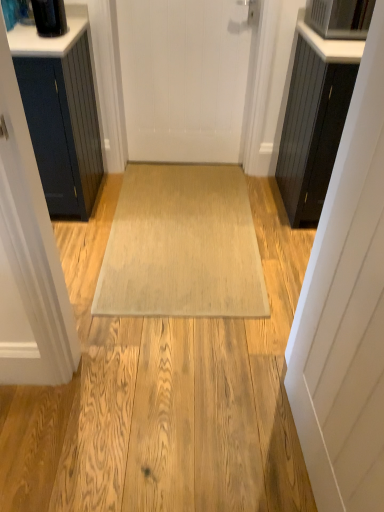
Describe the element at coordinates (346, 311) in the screenshot. I see `white matte door at right, the first door from the front` at that location.

What do you see at coordinates (182, 246) in the screenshot? This screenshot has height=512, width=384. I see `beige woven mat at center` at bounding box center [182, 246].

I want to click on satin silver microwave at upper right, so click(x=340, y=18).

Describe the element at coordinates (340, 18) in the screenshot. I see `satin silver microwave at upper right` at that location.

Where is `black wood cabinet at right`? Image resolution: width=384 pixels, height=512 pixels. black wood cabinet at right is located at coordinates (314, 120).

In the image, is white matte door at right, marked as the 1th door in a right-to-left arrangement, on the left side or the right side of satin silver microwave at upper right?

Clearly, white matte door at right, marked as the 1th door in a right-to-left arrangement, is on the left of satin silver microwave at upper right in the image.

How different are the orientations of white matte door at right, the first door from the front, and satin silver microwave at upper right in degrees?

The facing directions of white matte door at right, the first door from the front, and satin silver microwave at upper right are 87.1 degrees apart.

How far apart are white matte door at right, the first door from the front, and satin silver microwave at upper right?

white matte door at right, the first door from the front, is 4.78 feet away from satin silver microwave at upper right.

Considering the relative sizes of white matte door at right, which ranks as the first door in bottom-to-top order, and satin silver microwave at upper right in the image provided, is white matte door at right, which ranks as the first door in bottom-to-top order, wider than satin silver microwave at upper right?

No, white matte door at right, which ranks as the first door in bottom-to-top order, is not wider than satin silver microwave at upper right.

Which is more distant, (244, 219) or (27, 46)?

The point (244, 219) is more distant.

Which of these two, beige woven mat at center or black glossy container at upper left, is bigger?

beige woven mat at center.

Looking at this image, from their relative heights in the image, would you say beige woven mat at center is taller or shorter than black glossy container at upper left?

Considering their sizes, beige woven mat at center has less height than black glossy container at upper left.

Is point (334, 2) closer or farther from the camera than point (317, 441)?

Point (334, 2) appears to be farther away from the viewer than point (317, 441).

The image size is (384, 512). In order to click on door located in front of the satin silver microwave at upper right in this screenshot , I will do `click(346, 311)`.

Is satin silver microwave at upper right further to the viewer compared to white matte door at right, which appears as the second door when viewed from the back?

Yes.

Could you tell me if satin silver microwave at upper right is facing white matte door at right, the first door from the front?

Yes, satin silver microwave at upper right is facing white matte door at right, the first door from the front.

Can you tell me how much black wood cabinet at right and white matte door at right, the first door from the front, differ in facing direction?

86.4 degrees separate the facing orientations of black wood cabinet at right and white matte door at right, the first door from the front.

Does black wood cabinet at right have a lesser width compared to white matte door at right, which appears as the second door when viewed from the back?

Incorrect, the width of black wood cabinet at right is not less than that of white matte door at right, which appears as the second door when viewed from the back.

At what (x,y) coordinates should I click in order to perform the action: click on cabinetry that is on the right side of white matte door at right, the second door in the left-to-right sequence. Please return your answer as a coordinate pair (x, y). This screenshot has width=384, height=512. Looking at the image, I should click on (314, 120).

Considering the relative positions of black wood cabinet at right and white matte door at right, which ranks as the first door in bottom-to-top order, in the image provided, is black wood cabinet at right behind white matte door at right, which ranks as the first door in bottom-to-top order,?

That is True.

Looking at this image, which object is thinner, black glossy container at upper left or satin silver microwave at upper right?

black glossy container at upper left.

Between black glossy container at upper left and satin silver microwave at upper right, which one appears on the left side from the viewer's perspective?

black glossy container at upper left.

From a real-world perspective, is black glossy container at upper left on top of satin silver microwave at upper right?

Incorrect, from a real-world perspective, black glossy container at upper left is lower than satin silver microwave at upper right.

Looking at the image, does black glossy container at upper left seem bigger or smaller compared to satin silver microwave at upper right?

Clearly, black glossy container at upper left is smaller in size than satin silver microwave at upper right.

Which object is closer to the camera, white matte door at center, the 1th door viewed from the back, or black glossy container at upper left?

black glossy container at upper left.

From the image's perspective, which one is positioned lower, white matte door at center, the 1th door viewed from the back, or black glossy container at upper left?

white matte door at center, the 1th door viewed from the back.

In terms of width, does white matte door at center, which is counted as the first door, starting from the left, look wider or thinner when compared to black glossy container at upper left?

Clearly, white matte door at center, which is counted as the first door, starting from the left, has less width compared to black glossy container at upper left.

Image resolution: width=384 pixels, height=512 pixels. Identify the location of counter top above the white matte door at center, which is the 2th door from bottom to top (from a real-world perspective). (49, 38).

Is beige woven mat at center closer to camera compared to white matte door at center, which is the second door from front to back?

Yes, it is.

Is white matte door at center, the 1th door viewed from the back, a part of beige woven mat at center?

No, white matte door at center, the 1th door viewed from the back, is not surrounded by beige woven mat at center.

How much distance is there between beige woven mat at center and white matte door at center, the 1th door viewed from the back?

beige woven mat at center and white matte door at center, the 1th door viewed from the back, are 29.74 inches apart.

From a real-world perspective, is beige woven mat at center positioned above or below white matte door at center, the 1th door viewed from the back?

beige woven mat at center is below white matte door at center, the 1th door viewed from the back.

The height and width of the screenshot is (512, 384). What are the coordinates of `appliance that is behind the white matte door at right, marked as the 1th door in a right-to-left arrangement` in the screenshot? It's located at (340, 18).

The width and height of the screenshot is (384, 512). I want to click on counter top above the beige woven mat at center (from the image's perspective), so click(49, 38).

When comparing their distances from black wood cabinet at right, does satin silver microwave at upper right or white matte door at center, which is the second door from front to back, seem closer?

satin silver microwave at upper right is closer to black wood cabinet at right.

When comparing their distances from beige woven mat at center, does satin silver microwave at upper right or black glossy container at upper left seem closer?

Among the two, black glossy container at upper left is located nearer to beige woven mat at center.

From the image, which object appears to be nearer to satin silver microwave at upper right, white matte door at center, which is the second door from front to back, or black wood cabinet at right?

black wood cabinet at right is positioned closer to the anchor satin silver microwave at upper right.

Looking at the image, which one is located closer to black glossy container at upper left, black wood cabinet at right or white matte door at right, which ranks as the first door in bottom-to-top order?

black wood cabinet at right is positioned closer to the anchor black glossy container at upper left.

In the scene shown: Considering their positions, is satin silver microwave at upper right positioned further to black glossy container at upper left than white matte door at right, which ranks as the first door in bottom-to-top order?

white matte door at right, which ranks as the first door in bottom-to-top order, is positioned further to the anchor black glossy container at upper left.

Looking at the image, which one is located closer to white matte door at right, the first door from the front, satin silver microwave at upper right or black glossy container at upper left?

satin silver microwave at upper right lies closer to white matte door at right, the first door from the front, than the other object.

Estimate the real-world distances between objects in this image. Which object is closer to white matte door at right, the 2th door in the top-to-bottom sequence, white matte door at center, arranged as the first door when viewed from the top, or satin silver microwave at upper right?

Among the two, satin silver microwave at upper right is located nearer to white matte door at right, the 2th door in the top-to-bottom sequence.

Considering their positions, is white matte door at right, the 2th door in the top-to-bottom sequence, positioned closer to white matte door at center, arranged as the first door when viewed from the top, than black wood cabinet at right?

black wood cabinet at right is closer to white matte door at center, arranged as the first door when viewed from the top.

I want to click on doormat between black glossy container at upper left and black wood cabinet at right from left to right, so click(182, 246).

This screenshot has height=512, width=384. Identify the location of doormat between white matte door at right, which ranks as the first door in bottom-to-top order, and white matte door at center, the 1th door viewed from the back, from front to back. (182, 246).

This screenshot has width=384, height=512. In order to click on counter top positioned between white matte door at right, which appears as the second door when viewed from the back, and satin silver microwave at upper right from near to far in this screenshot , I will do `click(49, 38)`.

Where is `appliance located between white matte door at right, the 2th door in the top-to-bottom sequence, and white matte door at center, which is counted as the first door, starting from the left, in the depth direction`? The image size is (384, 512). appliance located between white matte door at right, the 2th door in the top-to-bottom sequence, and white matte door at center, which is counted as the first door, starting from the left, in the depth direction is located at coordinates (340, 18).